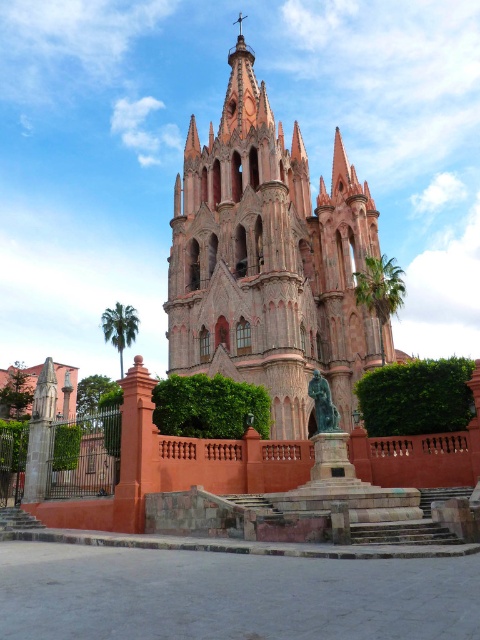
Question: In this image, where is red brick church at center located relative to bronze statue at center?

Choices:
 (A) left
 (B) right

Answer: (A)

Question: Which point is closer to the camera?

Choices:
 (A) bronze statue at center
 (B) red brick church at center

Answer: (A)

Question: Is red brick church at center to the right of bronze statue at center from the viewer's perspective?

Choices:
 (A) yes
 (B) no

Answer: (B)

Question: Can you confirm if red brick church at center is wider than bronze statue at center?

Choices:
 (A) no
 (B) yes

Answer: (B)